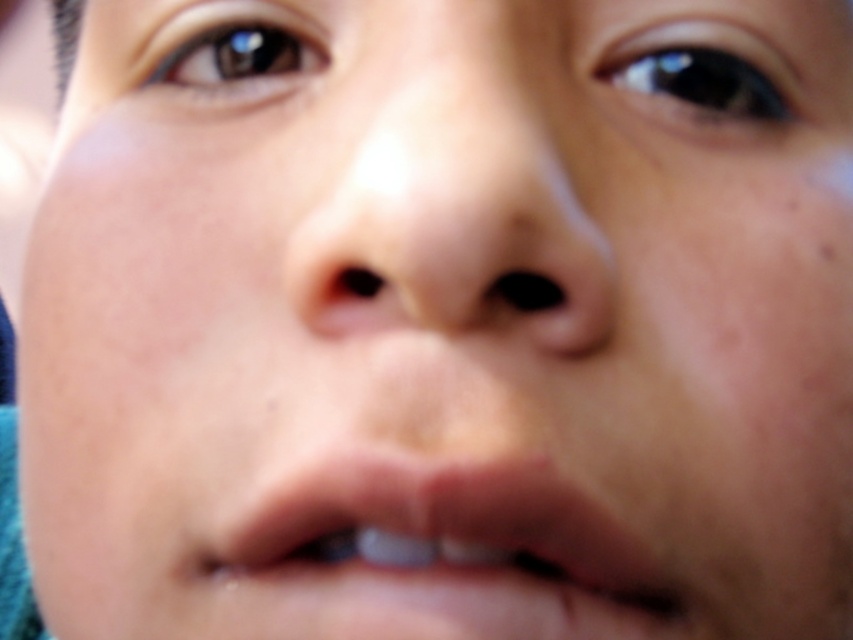
Question: Is smooth skin nose at center above pale pink flesh at center?

Choices:
 (A) yes
 (B) no

Answer: (A)

Question: Observing the image, what is the correct spatial positioning of smooth skin nose at center in reference to pale pink flesh at center?

Choices:
 (A) above
 (B) below

Answer: (A)

Question: Which point appears farthest from the camera in this image?

Choices:
 (A) (289, 544)
 (B) (509, 260)

Answer: (A)

Question: Which of the following is the closest to the observer?

Choices:
 (A) pale pink flesh at center
 (B) smooth skin nose at center

Answer: (B)

Question: Is smooth skin nose at center smaller than pale pink flesh at center?

Choices:
 (A) yes
 (B) no

Answer: (B)